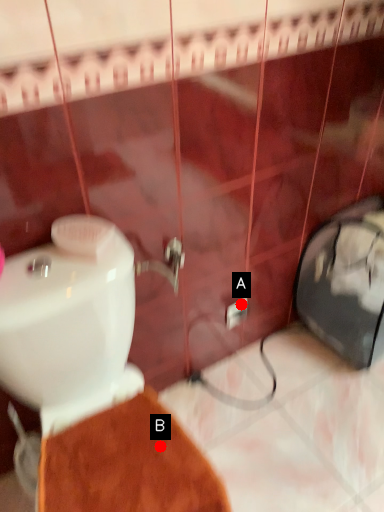
Question: Two points are circled on the image, labeled by A and B beside each circle. Which point is farther from the camera taking this photo?

Choices:
 (A) A is further
 (B) B is further

Answer: (A)